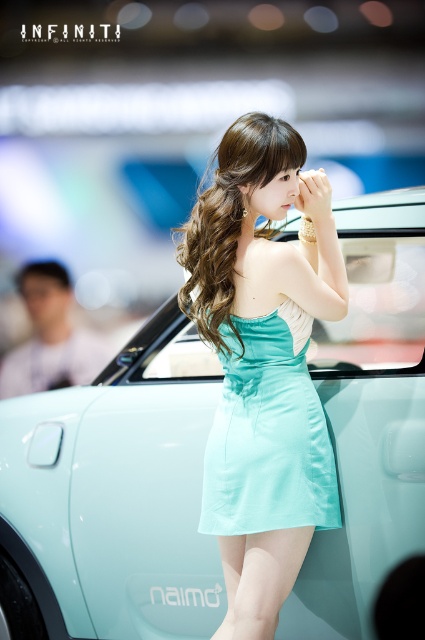
Question: Does teal satin dress at center have a larger size compared to mint satin dress at center?

Choices:
 (A) yes
 (B) no

Answer: (A)

Question: Does light blue satin car at center have a larger size compared to teal satin dress at center?

Choices:
 (A) no
 (B) yes

Answer: (B)

Question: Can you confirm if light blue satin car at center is thinner than teal satin dress at center?

Choices:
 (A) yes
 (B) no

Answer: (B)

Question: Which point is closer to the camera taking this photo?

Choices:
 (A) (337, 221)
 (B) (303, 496)
 (C) (286, 260)

Answer: (C)

Question: Among these objects, which one is farthest from the camera?

Choices:
 (A) mint satin dress at center
 (B) light blue satin car at center

Answer: (B)

Question: Which point is closer to the camera?

Choices:
 (A) (289, 182)
 (B) (334, 568)

Answer: (A)